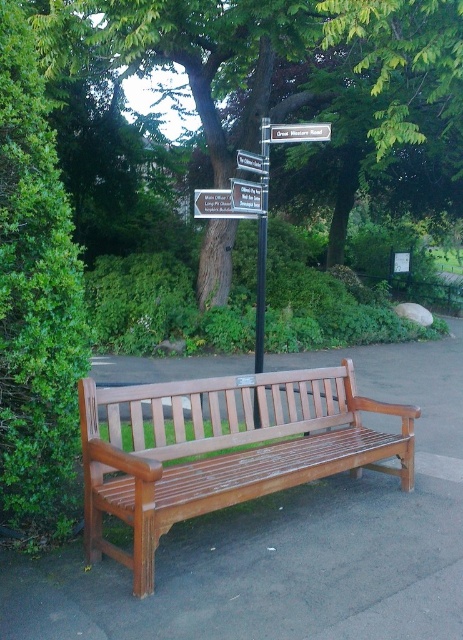
Does green leafy bush at left have a lesser width compared to white plastic street sign at upper center?

Yes.

Can you confirm if green leafy bush at left is bigger than white plastic street sign at upper center?

Indeed, green leafy bush at left has a larger size compared to white plastic street sign at upper center.

Between point (12, 200) and point (296, 124), which one is positioned behind?

The point (296, 124) is behind.

Locate an element on the screen. The height and width of the screenshot is (640, 463). green leafy bush at left is located at coordinates (36, 301).

Identify the location of polished wood bench at center. (223, 449).

Image resolution: width=463 pixels, height=640 pixels. What do you see at coordinates (223, 449) in the screenshot?
I see `polished wood bench at center` at bounding box center [223, 449].

What do you see at coordinates (223, 449) in the screenshot? I see `polished wood bench at center` at bounding box center [223, 449].

Where is `polished wood bench at center`? polished wood bench at center is located at coordinates (223, 449).

Consider the image. Between green leafy tree at center and metallic signpost at center, which one appears on the right side from the viewer's perspective?

green leafy tree at center

Identify the location of green leafy tree at center. (294, 86).